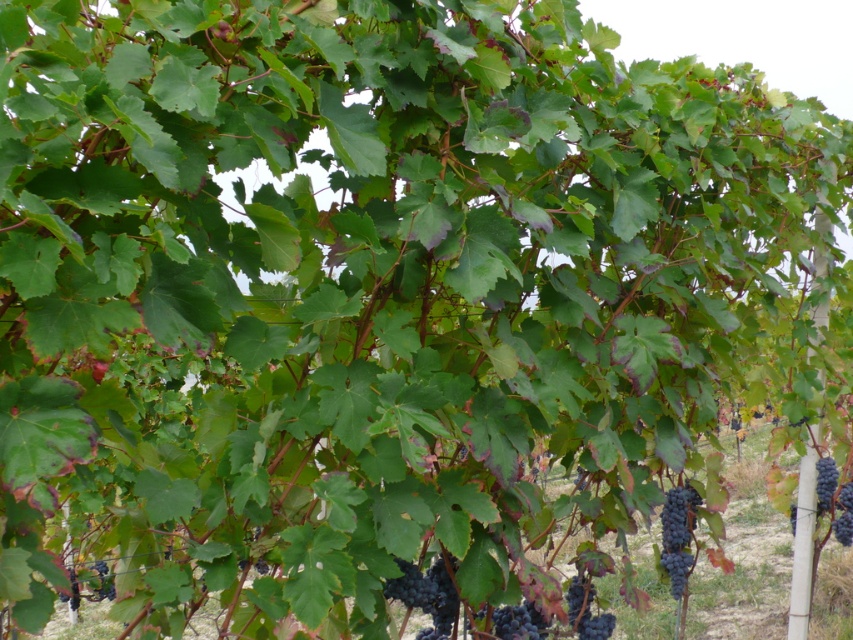
Question: Which object appears closest to the camera in this image?

Choices:
 (A) purple matte grape at lower left
 (B) dark purple grapes at center
 (C) dark purple grapes at right

Answer: (B)

Question: Where is dark purple grapes at right located in relation to purple matte grape at lower left in the image?

Choices:
 (A) above
 (B) below

Answer: (A)

Question: Which of the following is the closest to the observer?

Choices:
 (A) dark purple grapes at lower center
 (B) dark purple grapes at right

Answer: (A)

Question: Is dark purple grapes at lower right wider than dark purple grapes at right?

Choices:
 (A) no
 (B) yes

Answer: (A)

Question: Does dark purple grapes at lower right appear on the left side of purple matte grape at lower left?

Choices:
 (A) no
 (B) yes

Answer: (A)

Question: Considering the real-world distances, which object is farthest from the dark purple grapes at lower center?

Choices:
 (A) dark purple grapes at right
 (B) dark purple grapes at lower right

Answer: (A)